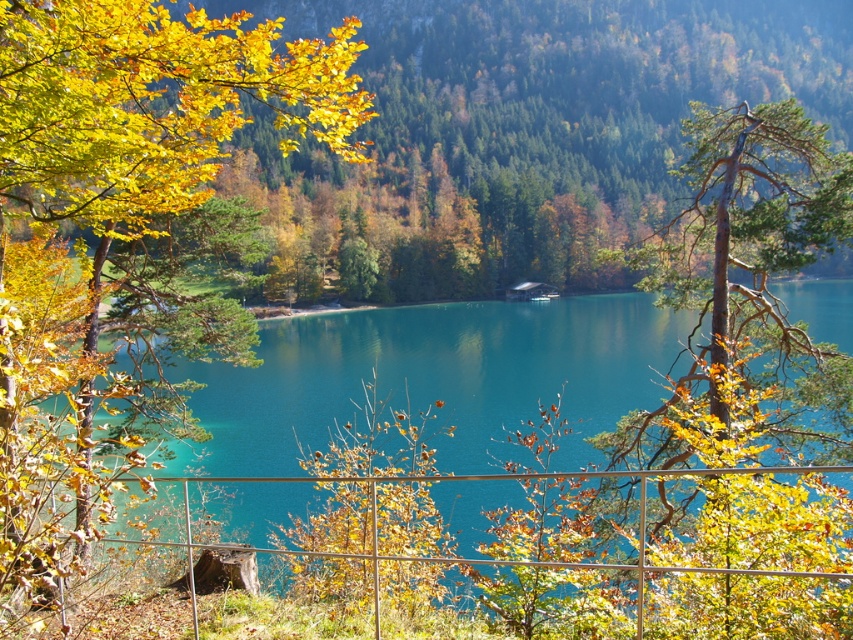
Question: Is smooth bark tree at center above metallic wire fence at lower center?

Choices:
 (A) no
 (B) yes

Answer: (B)

Question: Which object is the farthest from the metallic wire fence at lower center?

Choices:
 (A) turquoise glossy water at center
 (B) smooth bark tree at center
 (C) yellow leafy tree at upper left

Answer: (A)

Question: Which object is the closest to the turquoise glossy water at center?

Choices:
 (A) smooth bark tree at center
 (B) metallic wire fence at lower center
 (C) yellow leafy tree at upper left

Answer: (C)

Question: Can you confirm if smooth bark tree at center is positioned to the left of turquoise glossy water at center?

Choices:
 (A) yes
 (B) no

Answer: (A)

Question: Is yellow leafy tree at upper left wider than turquoise glossy water at center?

Choices:
 (A) no
 (B) yes

Answer: (A)

Question: Among these objects, which one is farthest from the camera?

Choices:
 (A) metallic wire fence at lower center
 (B) yellow leafy tree at upper left

Answer: (B)